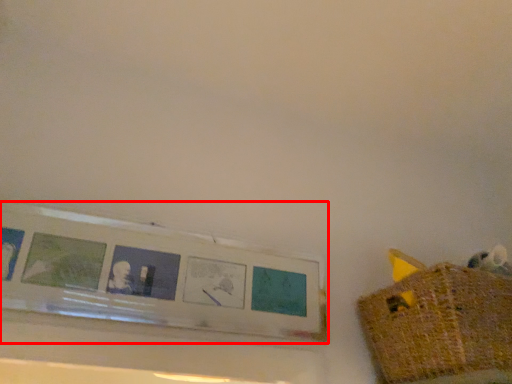
Question: From the image's perspective, where is picture frame (annotated by the red box) located in relation to basket in the image?

Choices:
 (A) below
 (B) above

Answer: (B)